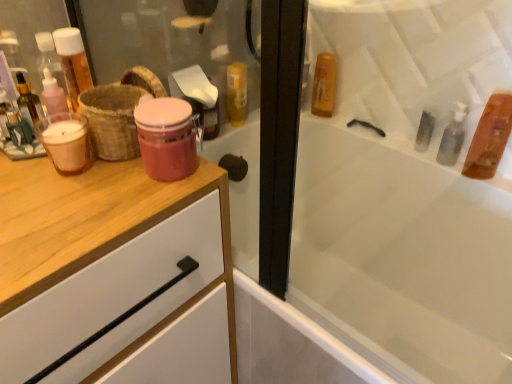
Question: Is translucent amber liquid at upper right, which is counted as the 1th mouthwash, starting from the right, bigger or smaller than matte pink glass jar at center, the 1th mouthwash positioned from the front?

Choices:
 (A) small
 (B) big

Answer: (B)

Question: In terms of height, does translucent amber liquid at upper right, the 3th mouthwash viewed from the front, look taller or shorter compared to matte pink glass jar at center, acting as the 2th mouthwash starting from the left?

Choices:
 (A) short
 (B) tall

Answer: (B)

Question: Which is nearer to the translucent amber liquid at upper right, marked as the fourth mouthwash in a front-to-back arrangement?

Choices:
 (A) white glossy bathtub at upper right
 (B) matte pink glass jar at center, which is the 4th mouthwash from back to front
 (C) translucent glass mouthwash at left, the first mouthwash positioned from the left
 (D) brown woven basket at left
 (E) translucent amber liquid at upper right, which appears as the 4th mouthwash when viewed from the left

Answer: (A)

Question: Estimate the real-world distances between objects in this image. Which object is farther from the translucent amber liquid at upper right, placed as the first mouthwash when sorted from back to front?

Choices:
 (A) translucent glass mouthwash at left, the third mouthwash when ordered from back to front
 (B) translucent amber liquid at upper right, the second mouthwash in the back-to-front sequence
 (C) white glossy bathtub at upper right
 (D) matte pink glass jar at center, the 1th mouthwash positioned from the front
 (E) brown woven basket at left

Answer: (A)